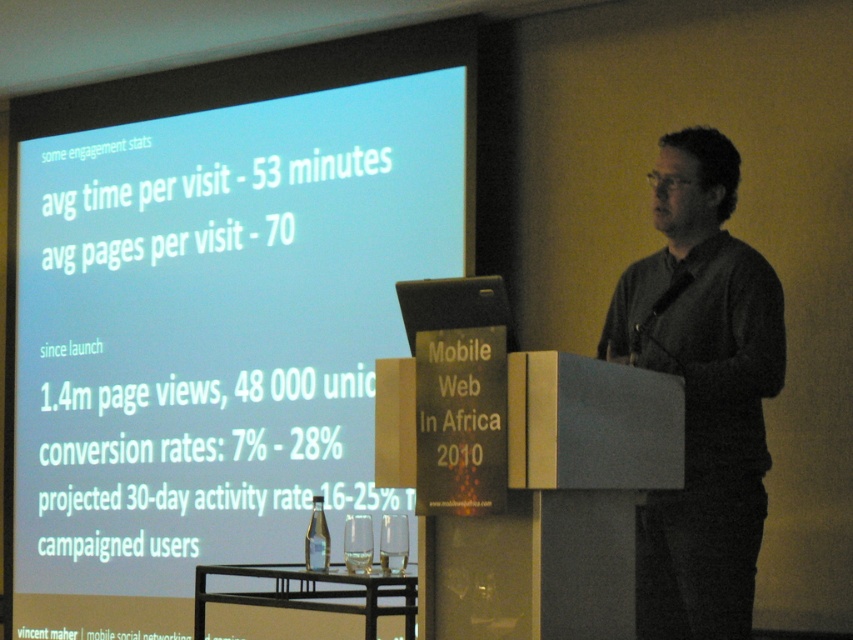
Question: Which is farther from the dark gray sweater at center?

Choices:
 (A) white matte projection screen at upper left
 (B) transparent glass at center
 (C) black wood podium at center
 (D) clear glass bottle at center

Answer: (A)

Question: Which point is closer to the camera?

Choices:
 (A) (728, 621)
 (B) (364, 582)
 (C) (387, 540)
 (D) (22, 257)

Answer: (B)

Question: Does transparent glass at center lie behind clear glass bottle at center?

Choices:
 (A) yes
 (B) no

Answer: (B)

Question: Does dark gray sweater at center have a smaller size compared to clear glass bottle at center?

Choices:
 (A) yes
 (B) no

Answer: (B)

Question: Considering the relative positions of transparent glass at lower center and transparent glass at center in the image provided, where is transparent glass at lower center located with respect to transparent glass at center?

Choices:
 (A) above
 (B) below

Answer: (A)

Question: Estimate the real-world distances between objects in this image. Which object is farther from the black wood podium at center?

Choices:
 (A) clear glass bottle at center
 (B) transparent glass at center

Answer: (B)